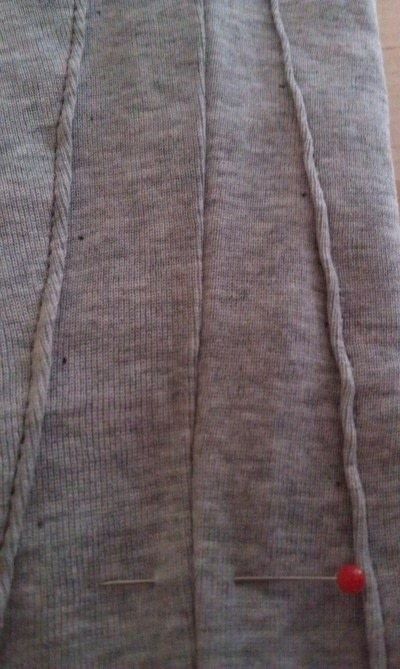
Where is `vertical seams in fabric`? Image resolution: width=400 pixels, height=669 pixels. vertical seams in fabric is located at coordinates (356, 475), (204, 506), (24, 478).